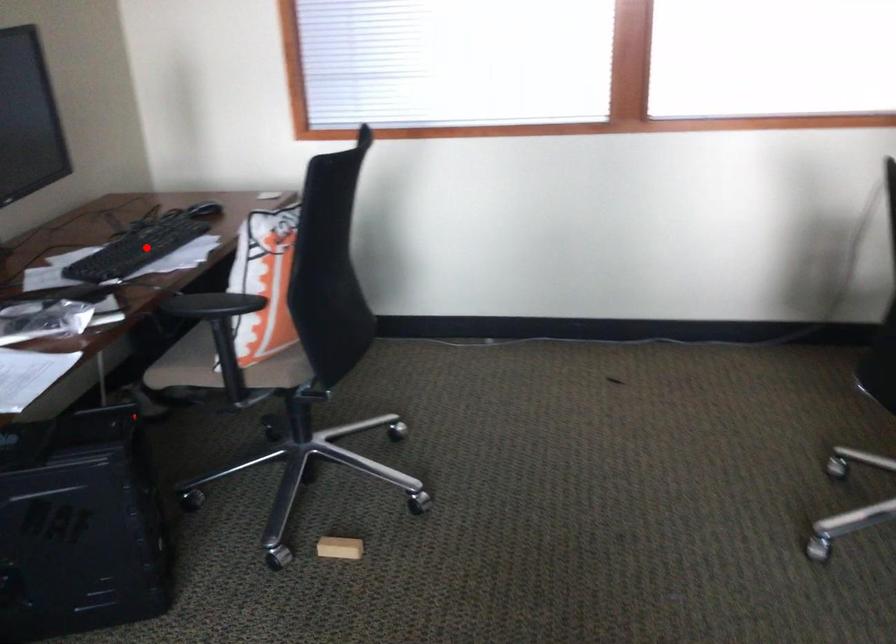
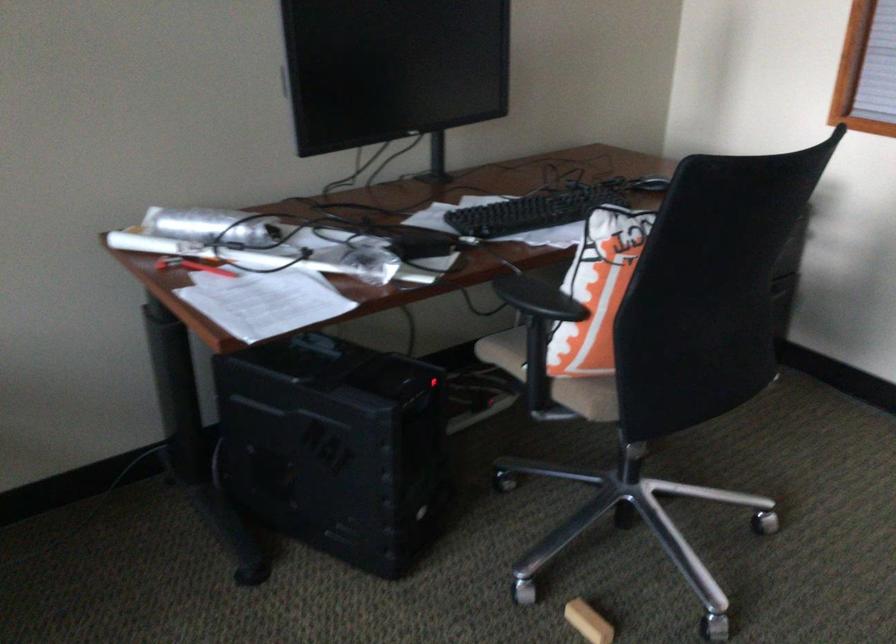
Question: I am providing you with two images of the same scene from different viewpoints. A red point is marked on the first image. At the location where the point appears in image 1, is it still visible in image 2?

Choices:
 (A) Yes
 (B) No

Answer: (A)